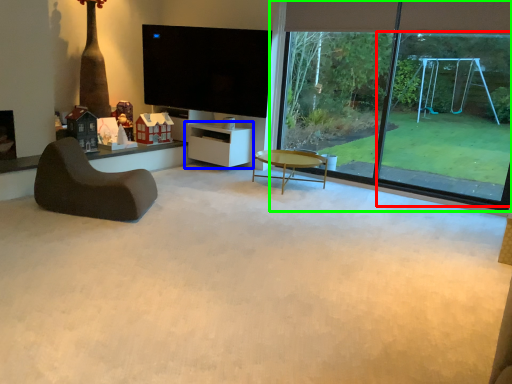
Question: Which is farther away from window frame (highlighted by a red box)? shelf (highlighted by a blue box) or window (highlighted by a green box)?

Choices:
 (A) shelf
 (B) window

Answer: (A)